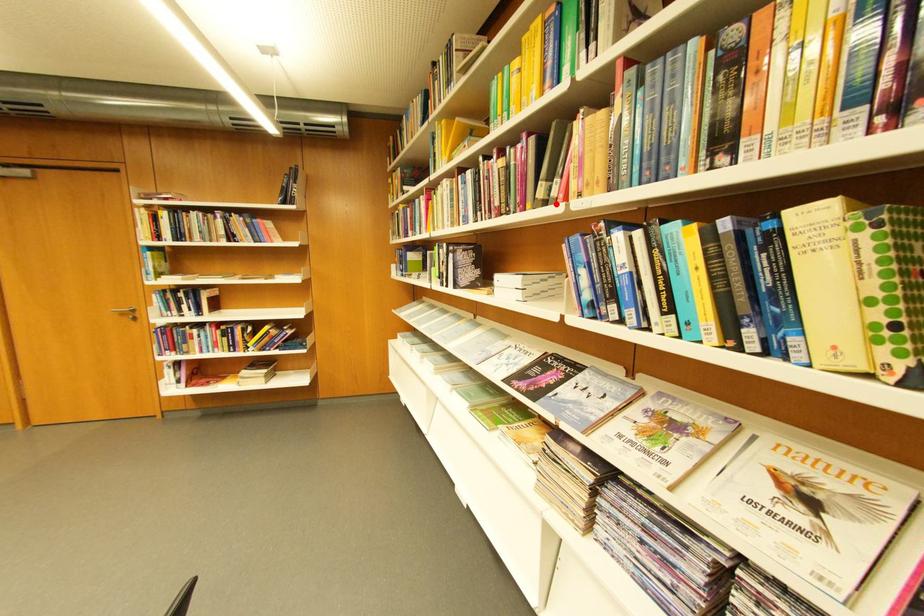
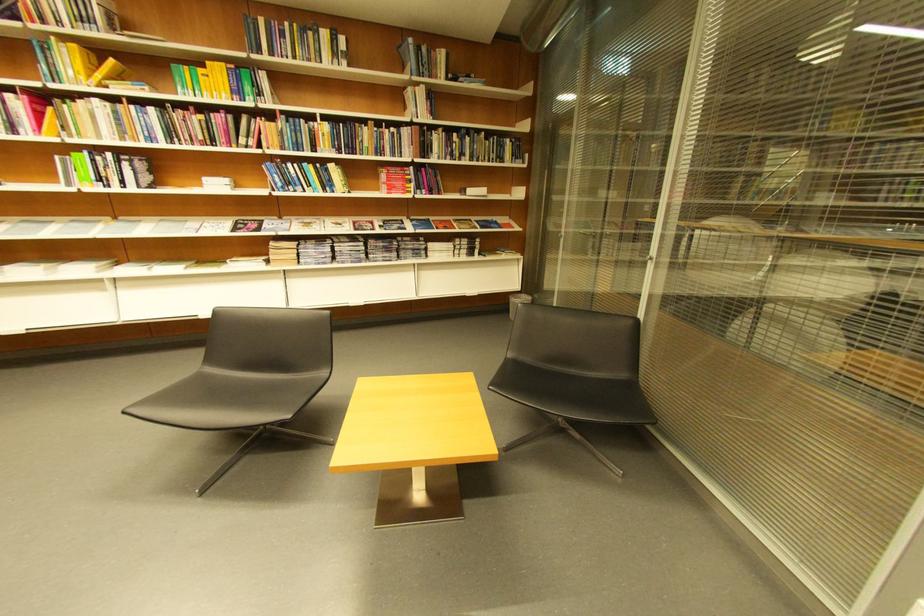
Locate, in the second image, the point that corresponds to the highlighted location in the first image.

(258, 148)